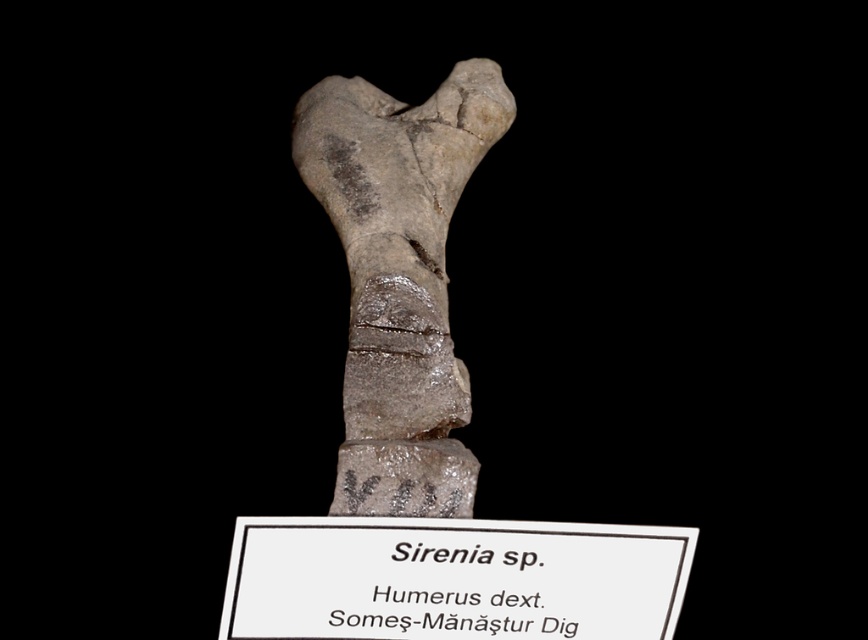
Which of these two, gray stone humerus at center or white paper at center, stands shorter?

white paper at center

Is gray stone humerus at center bigger than white paper at center?

Yes, gray stone humerus at center is bigger than white paper at center.

Which is behind, point (465, 392) or point (291, 561)?

Positioned behind is point (465, 392).

I want to click on gray stone humerus at center, so click(x=399, y=276).